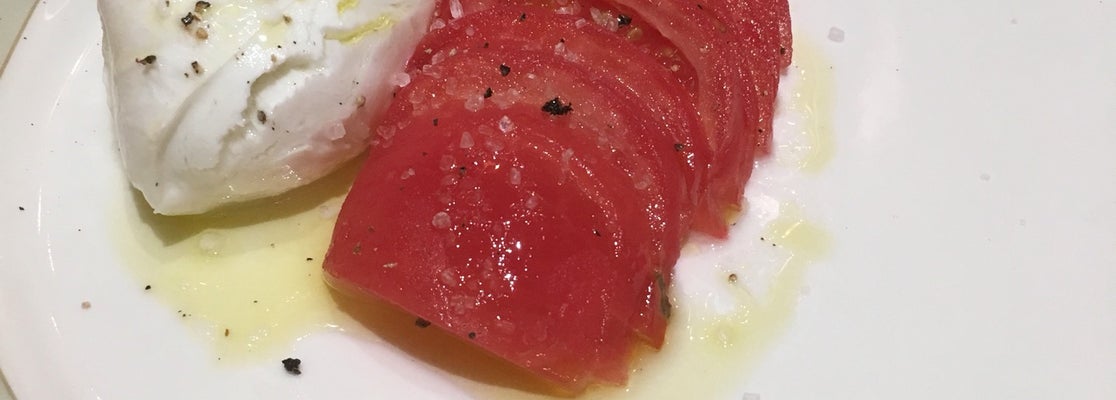
I want to click on dinner plate, so click(x=1002, y=114).